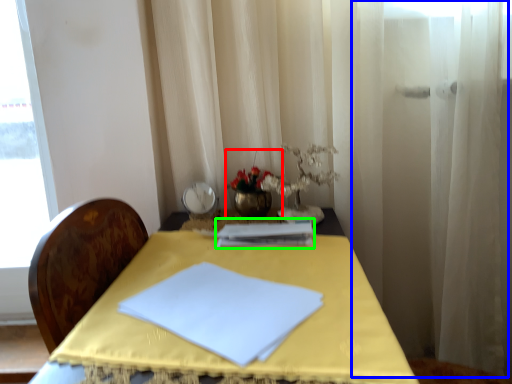
Question: Which is farther away from floral arrangement (highlighted by a red box)? curtain (highlighted by a blue box) or journal (highlighted by a green box)?

Choices:
 (A) curtain
 (B) journal

Answer: (A)